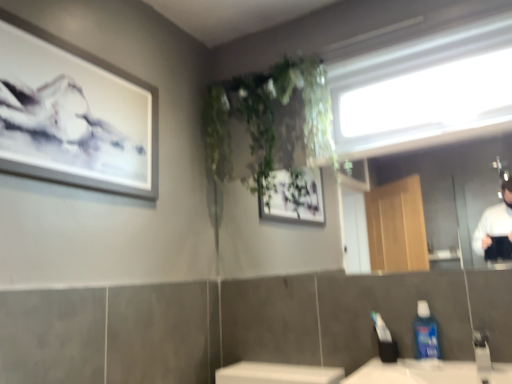
Find the location of `silver metallic faucet at lower right`. silver metallic faucet at lower right is located at coordinates (482, 350).

In order to face white matte picture frame at upper left, should I rotate leftwards or rightwards?

Turn left approximately 20.655 degrees to face it.

What do you see at coordinates (74, 115) in the screenshot? I see `white matte picture frame at upper left` at bounding box center [74, 115].

Describe the element at coordinates (425, 90) in the screenshot. I see `transparent glass window at upper center` at that location.

Describe the element at coordinates (426, 332) in the screenshot. I see `blue glossy mouthwash at lower right` at that location.

Find the location of a particular element. This screenshot has width=512, height=384. clear glass mirror at upper center is located at coordinates (450, 186).

From the image's perspective, which one is positioned higher, silver metallic faucet at lower right or clear glass mirror at upper center?

clear glass mirror at upper center appears higher in the image.

Is the depth of silver metallic faucet at lower right greater than that of clear glass mirror at upper center?

No, it is in front of clear glass mirror at upper center.

Can you tell me how much silver metallic faucet at lower right and clear glass mirror at upper center differ in facing direction?

The angle between the facing direction of silver metallic faucet at lower right and the facing direction of clear glass mirror at upper center is 0.98 degrees.

Measure the distance from silver metallic faucet at lower right to clear glass mirror at upper center.

silver metallic faucet at lower right and clear glass mirror at upper center are 11.14 feet apart from each other.

Between transparent glass window at upper center and blue glossy mouthwash at lower right, which one has more height?

Standing taller between the two is transparent glass window at upper center.

From the image's perspective, which one is positioned higher, transparent glass window at upper center or blue glossy mouthwash at lower right?

transparent glass window at upper center is shown above in the image.

Does transparent glass window at upper center turn towards blue glossy mouthwash at lower right?

No.

Are transparent glass window at upper center and blue glossy mouthwash at lower right located far from each other?

transparent glass window at upper center is near blue glossy mouthwash at lower right, not far away.

Is silver metallic faucet at lower right oriented away from white matte picture frame at upper left?

No, silver metallic faucet at lower right is not facing the opposite direction of white matte picture frame at upper left.

From the picture: In terms of height, does silver metallic faucet at lower right look taller or shorter compared to white matte picture frame at upper left?

In the image, silver metallic faucet at lower right appears to be shorter than white matte picture frame at upper left.

I want to click on picture frame in front of the silver metallic faucet at lower right, so (x=74, y=115).

Is point (483, 357) farther from camera compared to point (85, 139)?

No, (483, 357) is in front of (85, 139).

Does blue glossy mouthwash at lower right have a smaller size compared to transparent glass window at upper center?

Indeed, blue glossy mouthwash at lower right has a smaller size compared to transparent glass window at upper center.

Measure the distance from blue glossy mouthwash at lower right to transparent glass window at upper center.

34.34 inches.

Is blue glossy mouthwash at lower right thinner than transparent glass window at upper center?

Indeed, blue glossy mouthwash at lower right has a lesser width compared to transparent glass window at upper center.

The height and width of the screenshot is (384, 512). In the image, there is a blue glossy mouthwash at lower right. In order to click on window above it (from the image's perspective) in this screenshot , I will do `click(425, 90)`.

What's the angular difference between white matte picture frame at upper left and clear glass mirror at upper center's facing directions?

white matte picture frame at upper left and clear glass mirror at upper center are facing 89.9 degrees away from each other.

Considering the sizes of white matte picture frame at upper left and clear glass mirror at upper center in the image, is white matte picture frame at upper left bigger or smaller than clear glass mirror at upper center?

Considering their sizes, white matte picture frame at upper left takes up less space than clear glass mirror at upper center.

Can you confirm if white matte picture frame at upper left is thinner than clear glass mirror at upper center?

No, white matte picture frame at upper left is not thinner than clear glass mirror at upper center.

Is point (100, 80) closer to camera compared to point (478, 260)?

Yes, point (100, 80) is in front of point (478, 260).

From the image's perspective, is transparent glass window at upper center on top of silver metallic faucet at lower right?

Yes, from the image's perspective, transparent glass window at upper center is over silver metallic faucet at lower right.

Locate an element on the screen. The height and width of the screenshot is (384, 512). faucet on the right of transparent glass window at upper center is located at coordinates (482, 350).

Which of these two, transparent glass window at upper center or silver metallic faucet at lower right, is wider?

With larger width is transparent glass window at upper center.

Is point (436, 45) closer to camera compared to point (479, 345)?

That is False.

Between silver metallic faucet at lower right and blue glossy mouthwash at lower right, which one has larger width?

blue glossy mouthwash at lower right is wider.

From a real-world perspective, which object rests below the other?

In real-world perspective, silver metallic faucet at lower right is lower.

Would you say blue glossy mouthwash at lower right is part of silver metallic faucet at lower right's contents?

No, blue glossy mouthwash at lower right is not surrounded by silver metallic faucet at lower right.

Is silver metallic faucet at lower right bigger than blue glossy mouthwash at lower right?

No.

Identify the location of faucet located underneath the clear glass mirror at upper center (from a real-world perspective). The image size is (512, 384). (482, 350).

I want to click on window that appears above the blue glossy mouthwash at lower right (from the image's perspective), so click(425, 90).

Considering their positions, is white matte picture frame at upper left positioned closer to clear glass mirror at upper center than transparent glass window at upper center?

Among the two, transparent glass window at upper center is located nearer to clear glass mirror at upper center.

Looking at the image, which one is located further to white matte picture frame at upper left, blue glossy mouthwash at lower right or silver metallic faucet at lower right?

silver metallic faucet at lower right.

Based on their spatial positions, is transparent glass window at upper center or blue glossy mouthwash at lower right closer to clear glass mirror at upper center?

transparent glass window at upper center lies closer to clear glass mirror at upper center than the other object.

Which object lies nearer to the anchor point blue glossy mouthwash at lower right, clear glass mirror at upper center or white matte picture frame at upper left?

The object closer to blue glossy mouthwash at lower right is white matte picture frame at upper left.

From the image, which object appears to be farther from transparent glass window at upper center, white matte picture frame at upper left or blue glossy mouthwash at lower right?

Among the two, white matte picture frame at upper left is located further to transparent glass window at upper center.

Which object lies nearer to the anchor point clear glass mirror at upper center, transparent glass window at upper center or white matte picture frame at upper left?

Among the two, transparent glass window at upper center is located nearer to clear glass mirror at upper center.

Which object lies further to the anchor point silver metallic faucet at lower right, blue glossy mouthwash at lower right or white matte picture frame at upper left?

white matte picture frame at upper left.

Based on their spatial positions, is silver metallic faucet at lower right or transparent glass window at upper center closer to clear glass mirror at upper center?

The object closer to clear glass mirror at upper center is transparent glass window at upper center.

This screenshot has width=512, height=384. In order to click on cleaning product that lies between clear glass mirror at upper center and silver metallic faucet at lower right from top to bottom in this screenshot , I will do `click(426, 332)`.

Find the location of `mirror between transparent glass window at upper center and silver metallic faucet at lower right in the up-down direction`. mirror between transparent glass window at upper center and silver metallic faucet at lower right in the up-down direction is located at coordinates (450, 186).

Identify the location of mirror between transparent glass window at upper center and blue glossy mouthwash at lower right in the vertical direction. (450, 186).

Locate an element on the screen. mirror between white matte picture frame at upper left and transparent glass window at upper center in the horizontal direction is located at coordinates (450, 186).